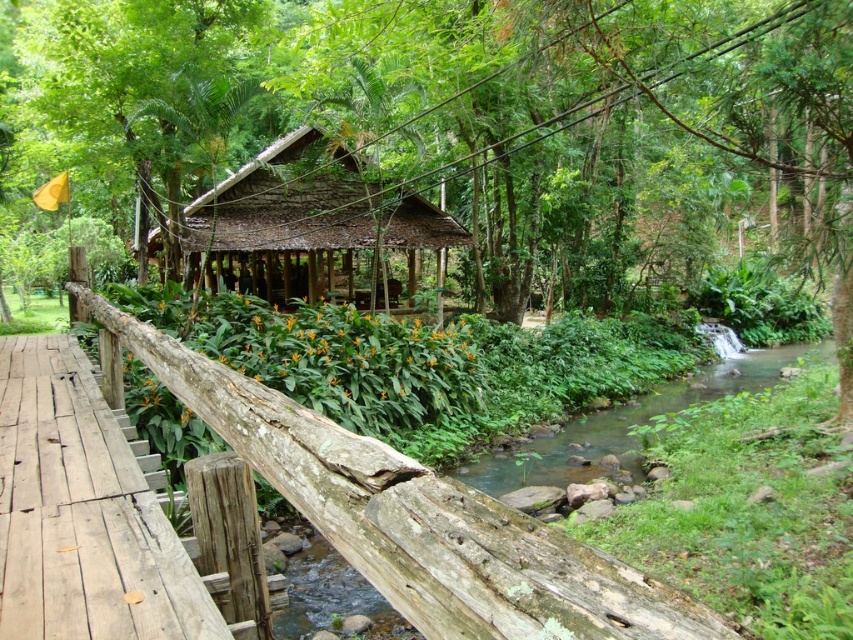
Question: Is green leafy forest at center closer to the viewer compared to wooden bridge at center?

Choices:
 (A) no
 (B) yes

Answer: (A)

Question: Which point is farther to the camera?

Choices:
 (A) green leafy forest at center
 (B) wooden bridge at center
 (C) thatched roof gazebo at center
 (D) green mossy river at center

Answer: (C)

Question: Can you confirm if green leafy forest at center is positioned above green mossy river at center?

Choices:
 (A) yes
 (B) no

Answer: (A)

Question: Considering the real-world distances, which object is closest to the thatched roof gazebo at center?

Choices:
 (A) green mossy river at center
 (B) wooden bridge at center
 (C) green leafy forest at center

Answer: (C)

Question: Which of the following is the closest to the observer?

Choices:
 (A) green mossy river at center
 (B) green leafy forest at center
 (C) wooden bridge at center
 (D) thatched roof gazebo at center

Answer: (C)

Question: Does green leafy forest at center have a greater width compared to thatched roof gazebo at center?

Choices:
 (A) yes
 (B) no

Answer: (A)